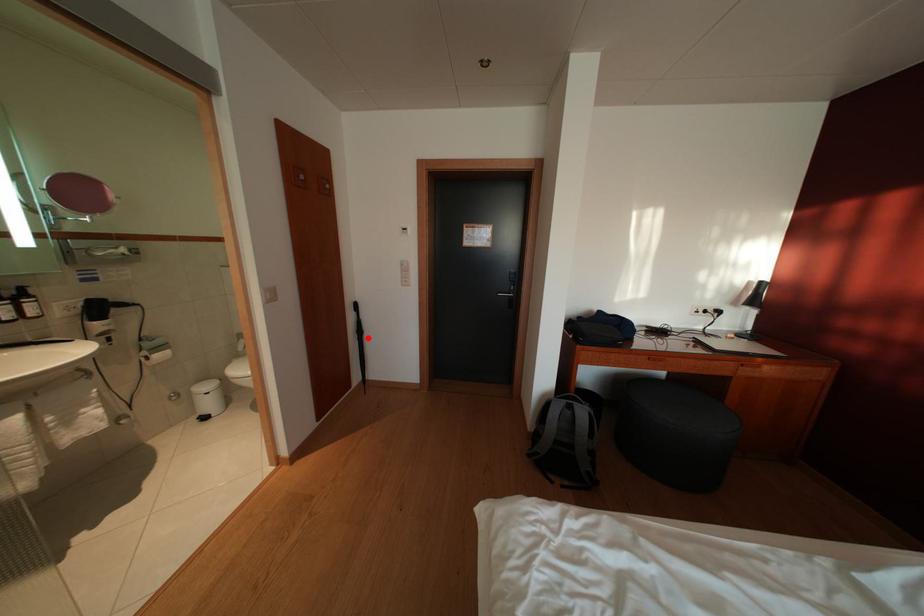
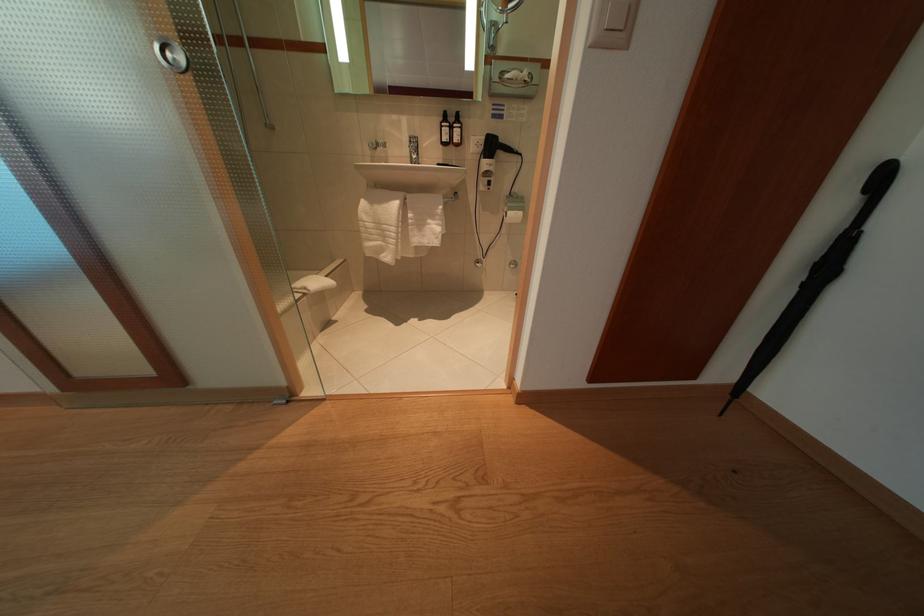
Where in the second image is the point corresponding to the highlighted location from the first image?

(834, 275)